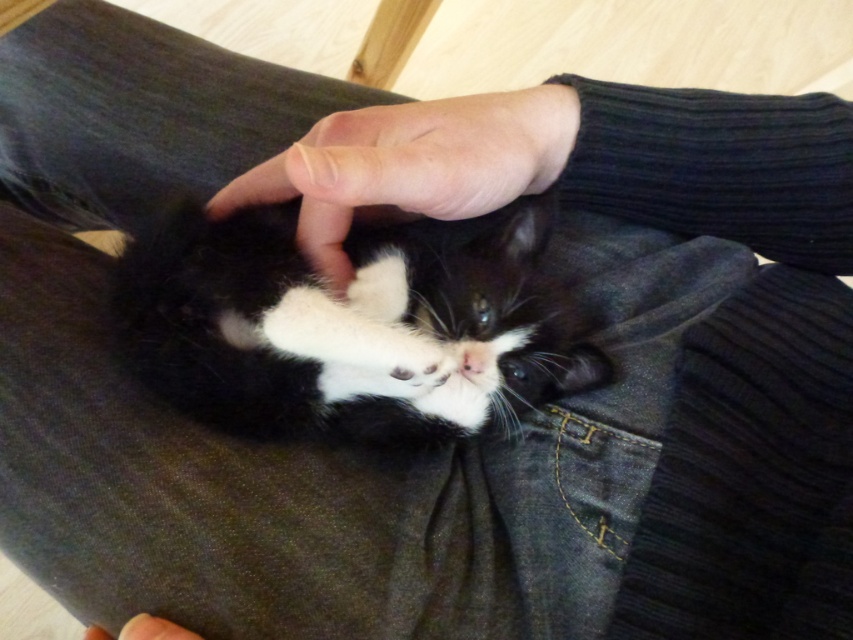
Is black soft fur cat at center to the right of smooth skin at center from the viewer's perspective?

Indeed, black soft fur cat at center is positioned on the right side of smooth skin at center.

Between black soft fur cat at center and smooth skin at center, which one has more height?

With more height is black soft fur cat at center.

Between point (410, 413) and point (160, 625), which one is positioned behind?

Positioned behind is point (410, 413).

You are a GUI agent. You are given a task and a screenshot of the screen. Output one action in this format:
    pyautogui.click(x=<x>, y=<y>)
    Task: Click on the black soft fur cat at center
    This screenshot has height=640, width=853.
    Given the screenshot: What is the action you would take?
    (352, 324)

Which is in front, point (468, 310) or point (503, 198)?

Positioned in front is point (468, 310).

Where is `black soft fur cat at center`? This screenshot has width=853, height=640. black soft fur cat at center is located at coordinates pos(352,324).

Between point (347, 241) and point (398, 177), which one is positioned in front?

Point (398, 177) is more forward.

You are a GUI agent. You are given a task and a screenshot of the screen. Output one action in this format:
    pyautogui.click(x=<x>, y=<y>)
    Task: Click on the black soft fur cat at center
    This screenshot has height=640, width=853.
    Given the screenshot: What is the action you would take?
    pyautogui.click(x=352, y=324)

Does black soft fur cat at center have a lesser width compared to denim at center?

No.

Is black soft fur cat at center taller than denim at center?

Correct, black soft fur cat at center is much taller as denim at center.

Which is behind, point (410, 372) or point (635, 472)?

The point (635, 472) is more distant.

You are a GUI agent. You are given a task and a screenshot of the screen. Output one action in this format:
    pyautogui.click(x=<x>, y=<y>)
    Task: Click on the black soft fur cat at center
    Image resolution: width=853 pixels, height=640 pixels.
    Given the screenshot: What is the action you would take?
    pyautogui.click(x=352, y=324)